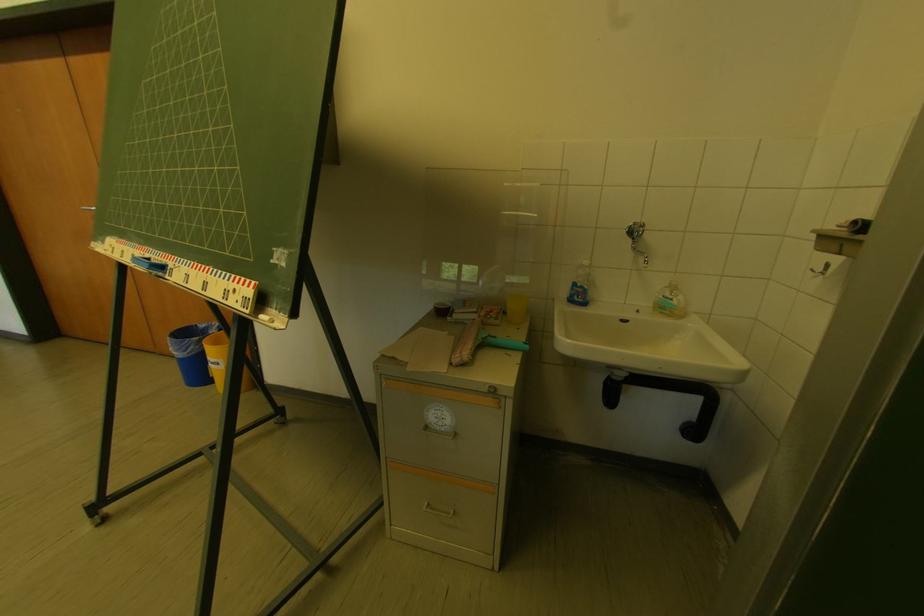
The image size is (924, 616). What do you see at coordinates (442, 523) in the screenshot?
I see `the top drawer handle` at bounding box center [442, 523].